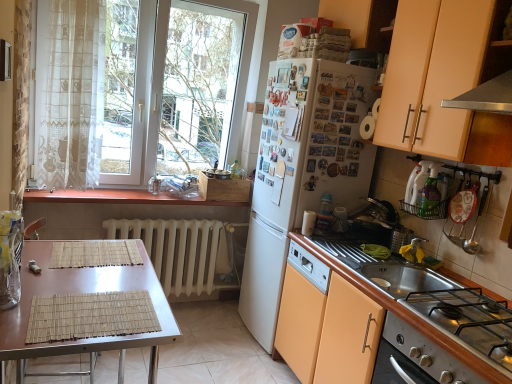
Question: Is white glossy cup at upper center, placed as the first appliance when sorted from bottom to top, to the left of white plastic dish rack at right, which ranks as the first appliance in top-to-bottom order, from the viewer's perspective?

Choices:
 (A) no
 (B) yes

Answer: (B)

Question: Does white glossy cup at upper center, placed as the second appliance when sorted from top to bottom, appear on the right side of white plastic dish rack at right, the second appliance viewed from the back?

Choices:
 (A) no
 (B) yes

Answer: (A)

Question: From a real-world perspective, is white glossy cup at upper center, which is counted as the 1th appliance, starting from the left, on white plastic dish rack at right, which is counted as the first appliance, starting from the right?

Choices:
 (A) no
 (B) yes

Answer: (A)

Question: Does white glossy cup at upper center, which is the first appliance from back to front, have a greater width compared to white plastic dish rack at right, which ranks as the first appliance in top-to-bottom order?

Choices:
 (A) yes
 (B) no

Answer: (B)

Question: Is white glossy cup at upper center, the 2th appliance positioned from the front, thinner than white plastic dish rack at right, which is counted as the 1th appliance, starting from the front?

Choices:
 (A) yes
 (B) no

Answer: (A)

Question: Is white glossy cup at upper center, placed as the first appliance when sorted from bottom to top, smaller than white plastic dish rack at right, arranged as the second appliance when viewed from the left?

Choices:
 (A) yes
 (B) no

Answer: (A)

Question: From a real-world perspective, is wooden at left below brown bamboo placemat at lower left?

Choices:
 (A) yes
 (B) no

Answer: (B)

Question: From the image's perspective, is wooden at left located above brown bamboo placemat at lower left?

Choices:
 (A) no
 (B) yes

Answer: (B)

Question: Can you confirm if wooden at left is positioned to the right of brown bamboo placemat at lower left?

Choices:
 (A) no
 (B) yes

Answer: (A)

Question: From a real-world perspective, is wooden at left over brown bamboo placemat at lower left?

Choices:
 (A) yes
 (B) no

Answer: (A)

Question: Considering the relative sizes of wooden at left and brown bamboo placemat at lower left in the image provided, is wooden at left thinner than brown bamboo placemat at lower left?

Choices:
 (A) yes
 (B) no

Answer: (A)

Question: Can you confirm if wooden at left is bigger than brown bamboo placemat at lower left?

Choices:
 (A) yes
 (B) no

Answer: (B)

Question: Could you tell me if stainless steel gas stove at lower right is facing white glossy cup at upper center, the second appliance in the right-to-left sequence?

Choices:
 (A) yes
 (B) no

Answer: (B)